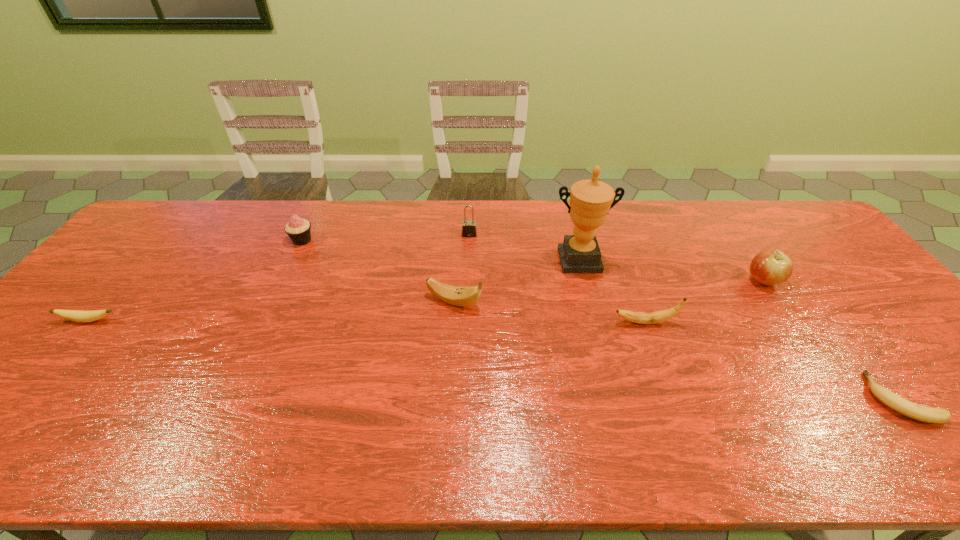
This screenshot has height=540, width=960. Find the location of `padlock that is at the far edge`. padlock that is at the far edge is located at coordinates (469, 229).

Image resolution: width=960 pixels, height=540 pixels. I want to click on cupcake located in the far edge section of the desktop, so click(x=298, y=229).

This screenshot has width=960, height=540. I want to click on object that is at the near edge, so click(x=915, y=411).

Locate an element on the screen. object that is at the left edge is located at coordinates (74, 315).

Locate an element on the screen. Image resolution: width=960 pixels, height=540 pixels. object that is positioned at the right edge is located at coordinates (915, 411).

You are a GUI agent. You are given a task and a screenshot of the screen. Output one action in this format:
    pyautogui.click(x=<x>, y=<y>)
    Task: Click on the object that is at the near right corner
    Image resolution: width=960 pixels, height=540 pixels.
    Given the screenshot: What is the action you would take?
    pyautogui.click(x=915, y=411)

Identify the location of free space at the far edge of the desktop. (551, 210).

This screenshot has height=540, width=960. In the image, there is a desktop. Identify the location of vacant space at the near edge. (354, 440).

You are a GUI agent. You are given a task and a screenshot of the screen. Output one action in this format:
    pyautogui.click(x=<x>, y=<y>)
    Task: Click on the free space at the left edge
    The image size is (960, 540).
    Given the screenshot: What is the action you would take?
    point(74,346)

This screenshot has width=960, height=540. What are the coordinates of `vacant space at the right edge of the desktop` in the screenshot? It's located at (828, 249).